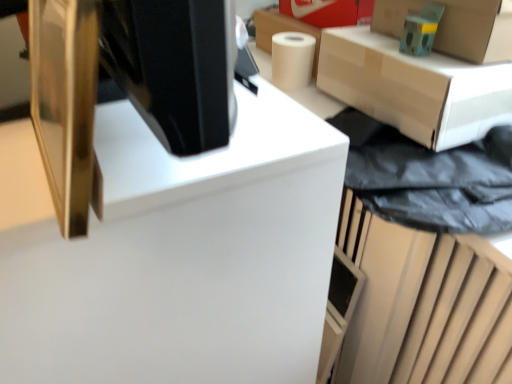
Question: Should I look upward or downward to see white glossy computer desk at center?

Choices:
 (A) down
 (B) up

Answer: (A)

Question: From a real-world perspective, is white matte paper towel at upper right on top of matte cardboard box at upper right?

Choices:
 (A) yes
 (B) no

Answer: (B)

Question: Is white matte paper towel at upper right looking in the opposite direction of matte cardboard box at upper right?

Choices:
 (A) yes
 (B) no

Answer: (B)

Question: Does white matte paper towel at upper right appear on the right side of matte cardboard box at upper right?

Choices:
 (A) no
 (B) yes

Answer: (A)

Question: Does white matte paper towel at upper right have a greater width compared to matte cardboard box at upper right?

Choices:
 (A) no
 (B) yes

Answer: (A)

Question: Is white matte paper towel at upper right positioned in front of matte cardboard box at upper right?

Choices:
 (A) yes
 (B) no

Answer: (B)

Question: Is white matte paper towel at upper right outside matte cardboard box at upper right?

Choices:
 (A) no
 (B) yes

Answer: (B)

Question: From the image's perspective, is matte cardboard box at upper right located beneath cardboard box at upper right?

Choices:
 (A) no
 (B) yes

Answer: (B)

Question: Would you say matte cardboard box at upper right is a long distance from cardboard box at upper right?

Choices:
 (A) yes
 (B) no

Answer: (B)

Question: From the image's perspective, is matte cardboard box at upper right over cardboard box at upper right?

Choices:
 (A) yes
 (B) no

Answer: (B)

Question: Considering the relative sizes of matte cardboard box at upper right and cardboard box at upper right in the image provided, is matte cardboard box at upper right shorter than cardboard box at upper right?

Choices:
 (A) yes
 (B) no

Answer: (B)

Question: Considering the relative sizes of matte cardboard box at upper right and cardboard box at upper right in the image provided, is matte cardboard box at upper right wider than cardboard box at upper right?

Choices:
 (A) yes
 (B) no

Answer: (A)

Question: Is matte cardboard box at upper right at the left side of cardboard box at upper right?

Choices:
 (A) yes
 (B) no

Answer: (A)

Question: Is gold metallic monitor at upper left bigger than white matte paper towel at upper right?

Choices:
 (A) yes
 (B) no

Answer: (A)